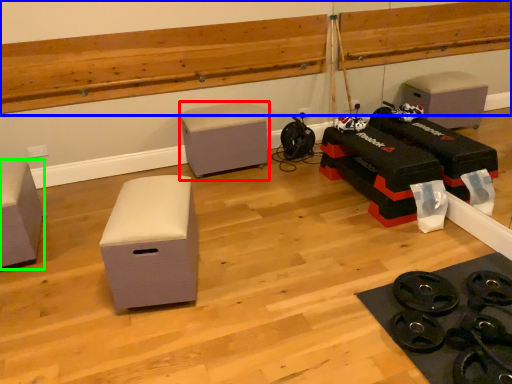
Question: Which object is the closest to the furniture (highlighted by a red box)? Choose among these: ledge (highlighted by a blue box) or furniture (highlighted by a green box).

Choices:
 (A) ledge
 (B) furniture

Answer: (A)